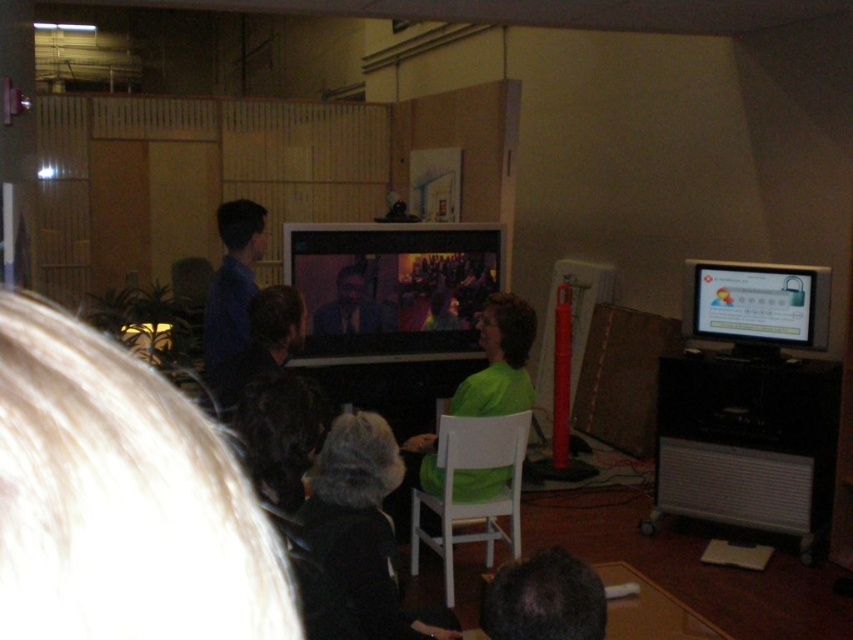
You are a photographer trying to capture a clear shot of both the dark gray knit hat at lower center and the dark brown hair at lower center. Since you want to ensure both are in focus, you need to know which object is larger. Can you tell me which one is bigger?

The dark gray knit hat at lower center is bigger than the dark brown hair at lower center, so you should focus on the larger object first to ensure both are in focus.

You are a photographer trying to capture a clear shot of both the dark gray knit hat at lower center and the dark brown hair at lower center. Since you want to ensure both are visible in your photo, which object should you focus on first considering their heights?

The dark gray knit hat at lower center is taller than the dark brown hair at lower center. Therefore, you should focus on the dark gray knit hat at lower center first to ensure proper depth of field, as it is the taller object.

You are standing in the room and want to focus on the matte black screen at center. Based on its position, which direction should you face to ensure you are looking directly at it?

The matte black screen at center is located at point coordinates, so you should face the center of the room to look directly at it.